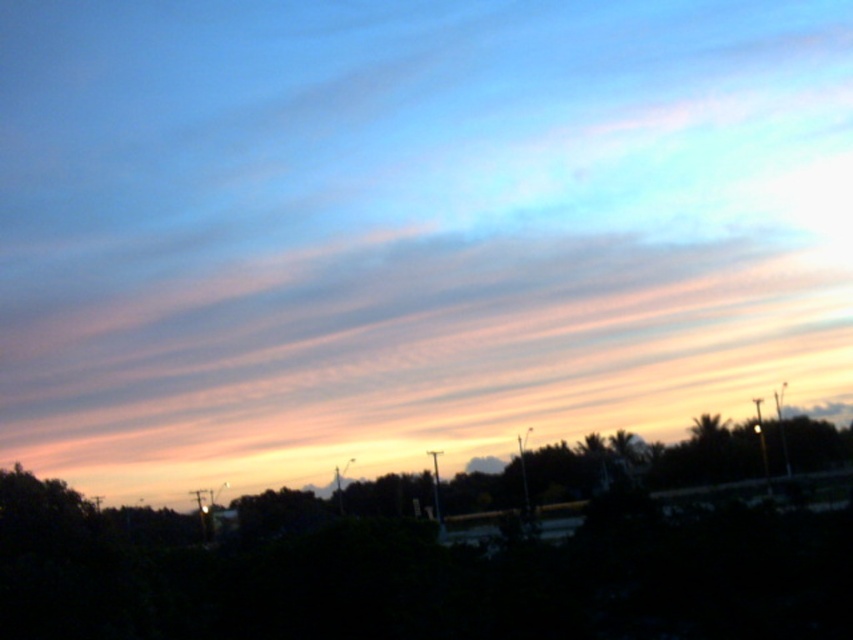
Where is `pink translucent clouds at upper center`? This screenshot has height=640, width=853. pink translucent clouds at upper center is located at coordinates tap(410, 353).

Can you confirm if pink translucent clouds at upper center is positioned to the right of dark green leafy tree at lower center?

Incorrect, pink translucent clouds at upper center is not on the right side of dark green leafy tree at lower center.

This screenshot has width=853, height=640. What are the coordinates of `pink translucent clouds at upper center` in the screenshot? It's located at (410, 353).